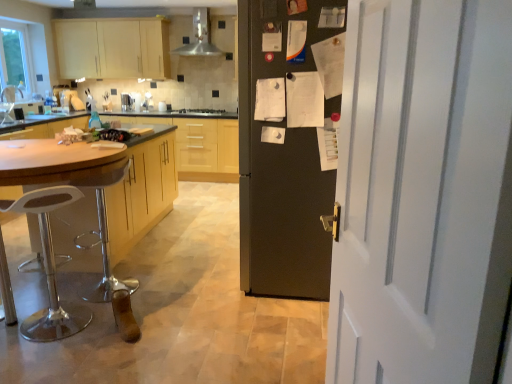
Locate an element on the screen. vacant space in front of matte black fridge at center is located at coordinates (259, 326).